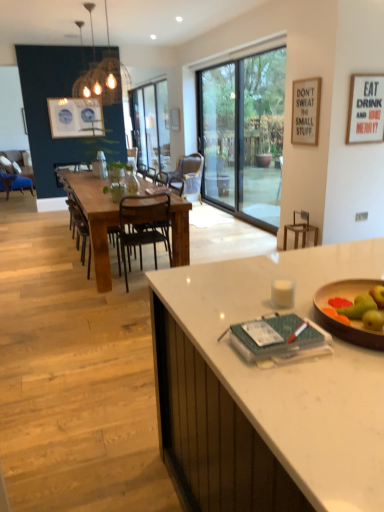
Question: Should I look upward or downward to see woven wood pendant light at upper center?

Choices:
 (A) up
 (B) down

Answer: (A)

Question: Can you confirm if clear glass bottle at center is wider than wooden chair at center, placed as the 1th chair when sorted from right to left?

Choices:
 (A) yes
 (B) no

Answer: (B)

Question: Considering the relative positions of clear glass bottle at center and wooden chair at center, which is the second chair from back to front, in the image provided, is clear glass bottle at center to the left of wooden chair at center, which is the second chair from back to front, from the viewer's perspective?

Choices:
 (A) yes
 (B) no

Answer: (A)

Question: Is clear glass bottle at center next to wooden chair at center, the 4th chair viewed from the front, and touching it?

Choices:
 (A) yes
 (B) no

Answer: (B)

Question: Is clear glass bottle at center surrounding wooden chair at center, which appears as the fifth chair when viewed from the left?

Choices:
 (A) no
 (B) yes

Answer: (A)

Question: Considering the relative sizes of clear glass bottle at center and wooden chair at center, the 4th chair viewed from the front, in the image provided, is clear glass bottle at center taller than wooden chair at center, the 4th chair viewed from the front,?

Choices:
 (A) no
 (B) yes

Answer: (A)

Question: Is clear glass bottle at center shorter than wooden chair at center, which appears as the fifth chair when viewed from the left?

Choices:
 (A) yes
 (B) no

Answer: (A)

Question: Is white matte picture frame at upper right, acting as the second picture frame starting from the bottom, turned away from blue ceramic plates at upper left?

Choices:
 (A) yes
 (B) no

Answer: (B)

Question: From the image's perspective, is white matte picture frame at upper right, the second picture frame when ordered from front to back, beneath blue ceramic plates at upper left?

Choices:
 (A) yes
 (B) no

Answer: (A)

Question: From the image's perspective, does white matte picture frame at upper right, the second picture frame positioned from the left, appear higher than blue ceramic plates at upper left?

Choices:
 (A) no
 (B) yes

Answer: (A)

Question: Is white matte picture frame at upper right, acting as the second picture frame starting from the bottom, at the right side of blue ceramic plates at upper left?

Choices:
 (A) yes
 (B) no

Answer: (A)

Question: Is the position of white matte picture frame at upper right, the second picture frame positioned from the left, more distant than that of blue ceramic plates at upper left?

Choices:
 (A) yes
 (B) no

Answer: (B)

Question: Is white matte picture frame at upper right, the second picture frame when ordered from front to back, oriented towards blue ceramic plates at upper left?

Choices:
 (A) yes
 (B) no

Answer: (B)

Question: Is the position of white matte picture frame at upper right, the second picture frame when ordered from front to back, more distant than that of brown wooden chair at center, the fourth chair when ordered from right to left?

Choices:
 (A) yes
 (B) no

Answer: (A)